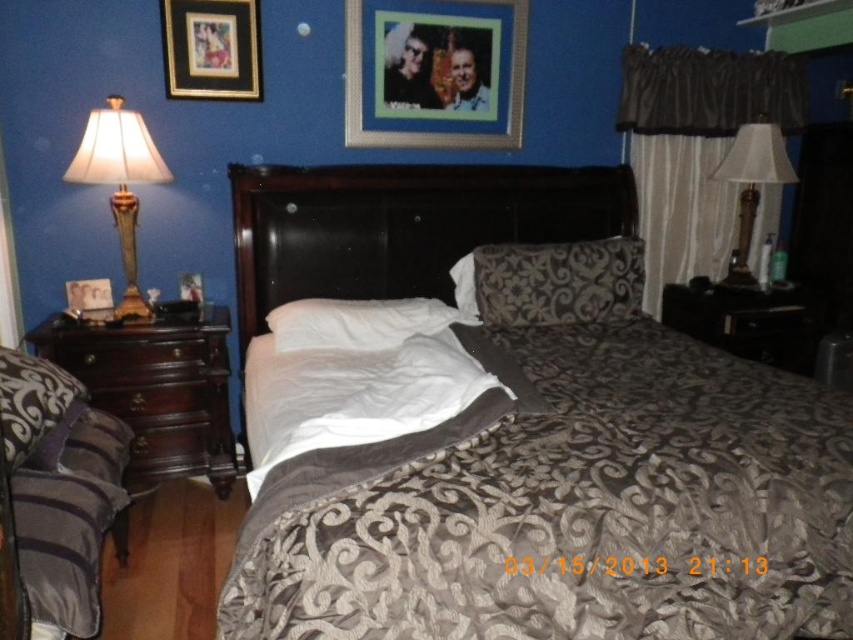
Can you confirm if white fabric lampshade at right is positioned above metallic silver picture frame at center?

Indeed, white fabric lampshade at right is positioned over metallic silver picture frame at center.

Which of these two, white fabric lampshade at right or metallic silver picture frame at center, stands shorter?

metallic silver picture frame at center

Which is behind, point (766, 150) or point (184, 292)?

The point (766, 150) is behind.

Locate an element on the screen. Image resolution: width=853 pixels, height=640 pixels. white fabric lampshade at right is located at coordinates (751, 184).

Does dark wood headboard at center appear on the right side of matte black picture frame at left?

Yes, dark wood headboard at center is to the right of matte black picture frame at left.

Consider the image. Between dark wood headboard at center and matte black picture frame at left, which one appears on the left side from the viewer's perspective?

matte black picture frame at left

Does point (535, 172) lie behind point (77, 282)?

Yes.

Identify the location of dark wood headboard at center. Image resolution: width=853 pixels, height=640 pixels. (402, 225).

Does brown textured bed at center have a larger size compared to metallic silver picture frame at upper center?

Yes.

Is point (480, 460) positioned after point (491, 0)?

No.

Identify the location of brown textured bed at center. The height and width of the screenshot is (640, 853). coord(567,506).